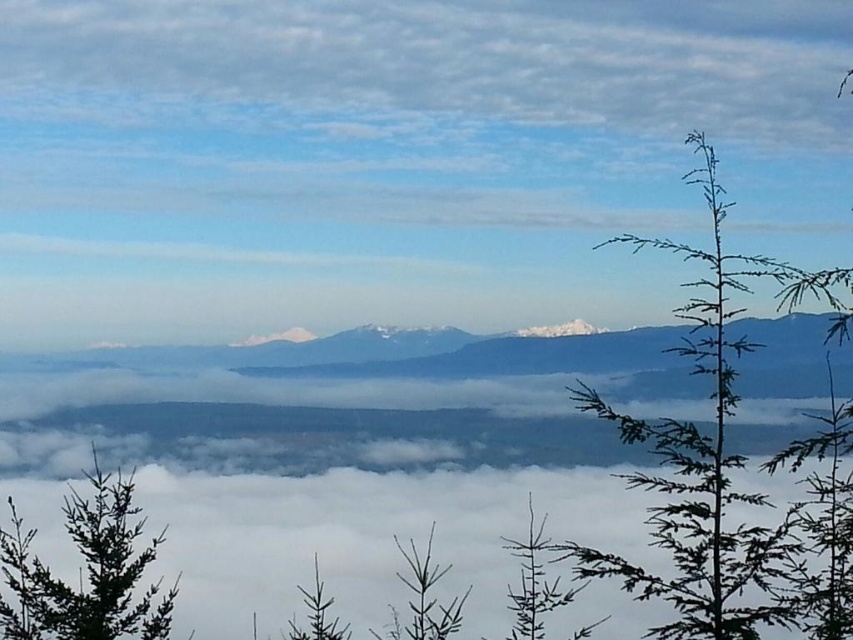
Which is above, green matte tree at center or green matte tree at lower center?

green matte tree at center is higher up.

Is green matte tree at center shorter than green matte tree at lower center?

In fact, green matte tree at center may be taller than green matte tree at lower center.

Which is behind, point (450, 620) or point (317, 588)?

The point (317, 588) is more distant.

In order to click on green matte tree at center in this screenshot , I will do `click(422, 596)`.

Is point (701, 616) positioned after point (306, 602)?

Yes, it is behind point (306, 602).

Which is in front, point (722, 435) or point (326, 605)?

Positioned in front is point (326, 605).

At what (x,y) coordinates should I click in order to perform the action: click on green needle-like tree at right. Please return your answer as a coordinate pair (x, y). Looking at the image, I should click on (703, 460).

Is green needle-like tree at right shorter than green matte tree at lower left?

In fact, green needle-like tree at right may be taller than green matte tree at lower left.

Between point (631, 435) and point (6, 580), which one is positioned in front?

Point (6, 580) is in front.

Identify the location of green needle-like tree at right. The height and width of the screenshot is (640, 853). (703, 460).